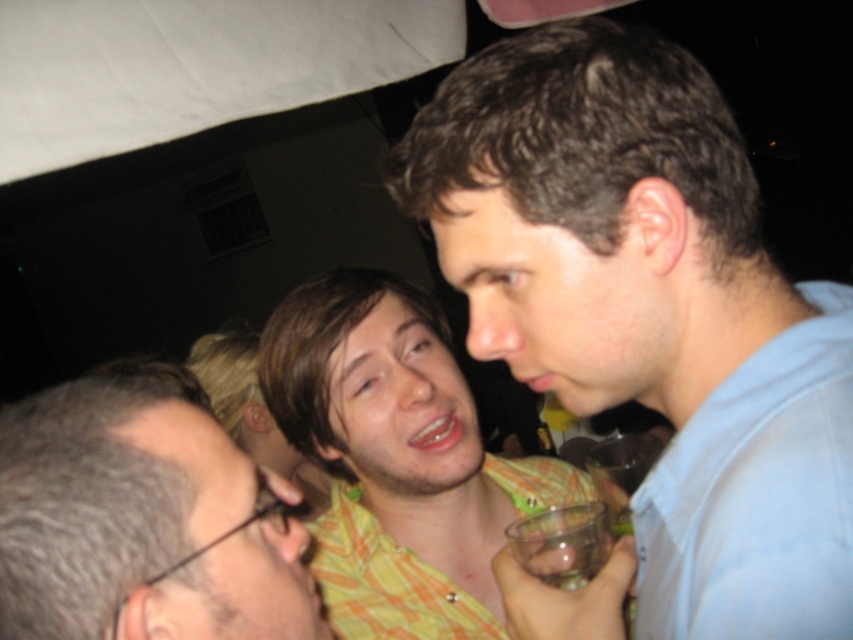
You are standing at the entrance of the venue and want to locate the person wearing the blue cotton shirt at center and the person with gray hair at lower left. Which of these two individuals is taller?

The blue cotton shirt at center has a greater height compared to gray hair at lower left, so the person wearing the blue cotton shirt at center is taller.